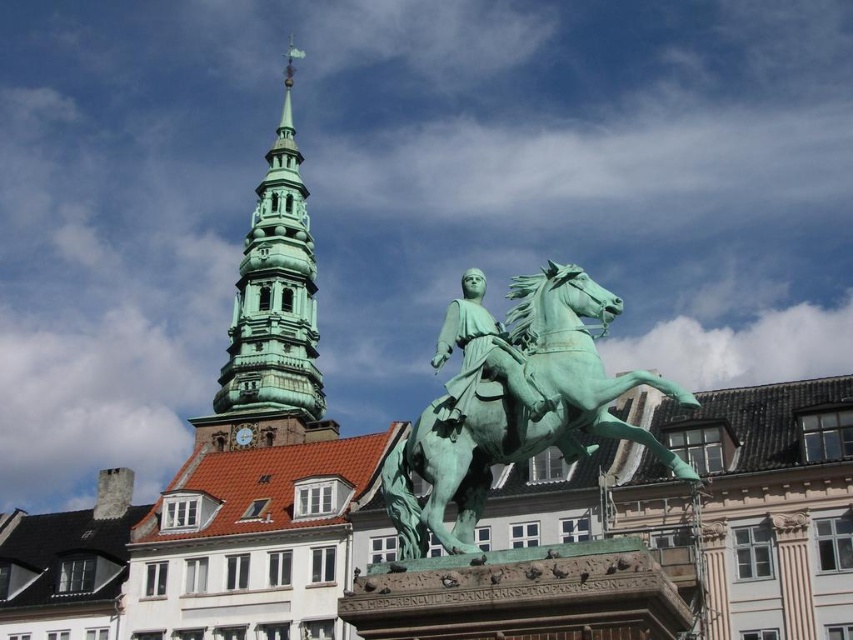
Can you confirm if green patinated metal horse at center is wider than green polished stone tower at upper left?

In fact, green patinated metal horse at center might be narrower than green polished stone tower at upper left.

Can you confirm if green patinated metal horse at center is thinner than green polished stone tower at upper left?

Indeed, green patinated metal horse at center has a lesser width compared to green polished stone tower at upper left.

This screenshot has width=853, height=640. I want to click on green patinated metal horse at center, so click(x=514, y=406).

Is point (228, 336) in front of point (468, 289)?

No, (228, 336) is further to viewer.

Between green polished stone tower at upper left and green patinated bronze statue at center, which one appears on the left side from the viewer's perspective?

green polished stone tower at upper left is more to the left.

Is point (265, 282) in front of point (480, 278)?

No, it is not.

Where is `green polished stone tower at upper left`? The width and height of the screenshot is (853, 640). green polished stone tower at upper left is located at coordinates (271, 314).

Between green patinated metal horse at center and green patinated bronze statue at center, which one appears on the left side from the viewer's perspective?

From the viewer's perspective, green patinated bronze statue at center appears more on the left side.

Which is behind, point (399, 540) or point (550, 404)?

Positioned behind is point (399, 540).

At what (x,y) coordinates should I click in order to perform the action: click on green patinated metal horse at center. Please return your answer as a coordinate pair (x, y). Image resolution: width=853 pixels, height=640 pixels. Looking at the image, I should click on (514, 406).